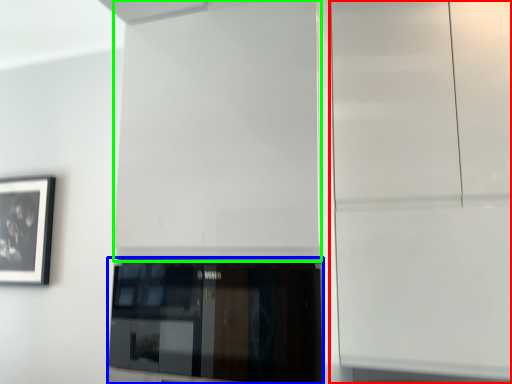
Question: Based on their relative distances, which object is nearer to glass door (highlighted by a red box)? Choose from window (highlighted by a blue box) and door (highlighted by a green box).

Choices:
 (A) window
 (B) door

Answer: (B)